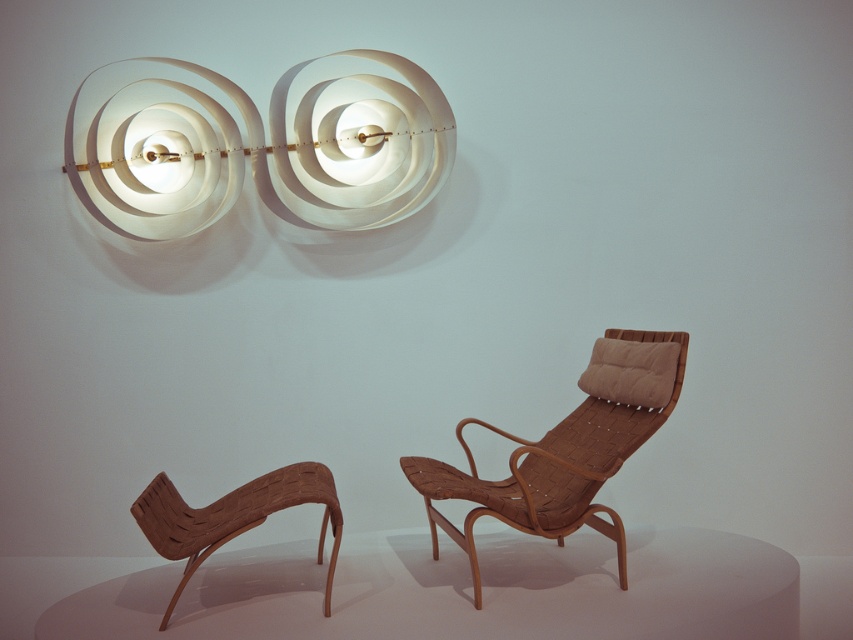
Can you confirm if white paper lamp at upper center is positioned above brown woven wood armchair at center?

Yes.

Identify the location of white paper lamp at upper center. This screenshot has width=853, height=640. (254, 147).

Can you confirm if brown woven wood armchair at center is thinner than brown woven armchair at lower left?

In fact, brown woven wood armchair at center might be wider than brown woven armchair at lower left.

Is brown woven wood armchair at center to the right of brown woven armchair at lower left from the viewer's perspective?

Yes, brown woven wood armchair at center is to the right of brown woven armchair at lower left.

Measure the distance between brown woven wood armchair at center and camera.

The distance of brown woven wood armchair at center from camera is 8.16 feet.

Image resolution: width=853 pixels, height=640 pixels. I want to click on brown woven wood armchair at center, so click(566, 449).

Can you confirm if white paper lamp at upper center is smaller than brown woven armchair at lower left?

No.

Where is `white paper lamp at upper center`? white paper lamp at upper center is located at coordinates (254, 147).

Does point (314, 102) come behind point (328, 598)?

Yes, point (314, 102) is farther from viewer.

You are a GUI agent. You are given a task and a screenshot of the screen. Output one action in this format:
    pyautogui.click(x=<x>, y=<y>)
    Task: Click on the white paper lamp at upper center
    
    Given the screenshot: What is the action you would take?
    pyautogui.click(x=254, y=147)